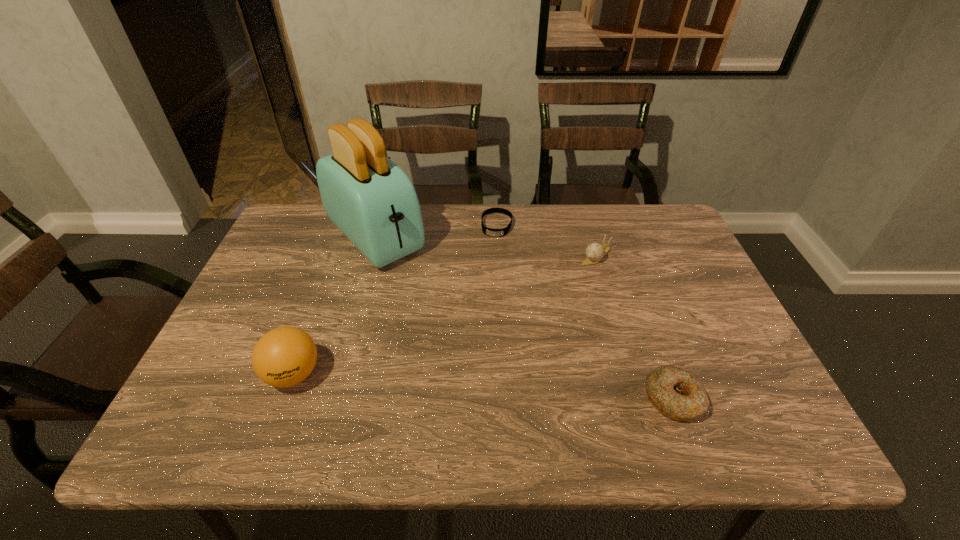
You are a GUI agent. You are given a task and a screenshot of the screen. Output one action in this format:
    pyautogui.click(x=<x>, y=<y>)
    Task: Click on the ping-pong ball
    
    Given the screenshot: What is the action you would take?
    pyautogui.click(x=285, y=356)

The height and width of the screenshot is (540, 960). In order to click on doughnut in this screenshot , I will do `click(678, 394)`.

Where is `toaster`? toaster is located at coordinates (372, 201).

The height and width of the screenshot is (540, 960). I want to click on escargot, so click(595, 251).

Find the location of `the shortest object`. the shortest object is located at coordinates (487, 231).

Where is `the third object from right to left`? This screenshot has width=960, height=540. the third object from right to left is located at coordinates (487, 231).

This screenshot has height=540, width=960. Identify the location of vacant area situated on the right of the doughnut. (750, 399).

The width and height of the screenshot is (960, 540). I want to click on free location located on the side of the tallest object with the lever, so click(x=442, y=306).

Where is `vacant space situated 0.050m on the side of the tallest object with the lever`? vacant space situated 0.050m on the side of the tallest object with the lever is located at coordinates (413, 276).

The image size is (960, 540). I want to click on vacant region located on the side of the tallest object with the lever, so click(436, 299).